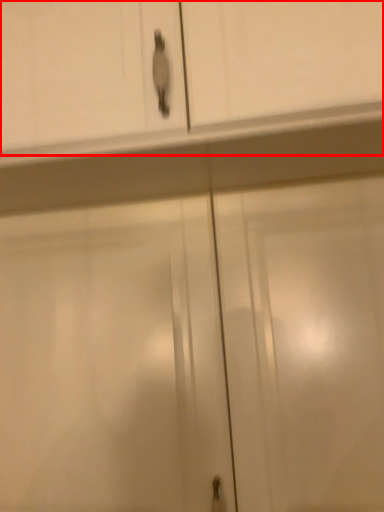
Question: From the image's perspective, where is cabinetry (annotated by the red box) located in relation to screen door in the image?

Choices:
 (A) above
 (B) below

Answer: (A)